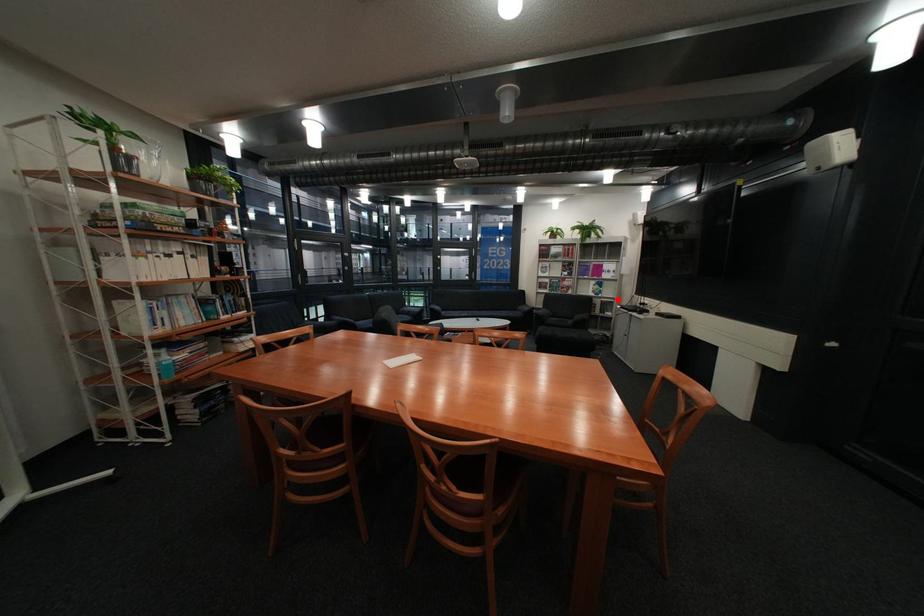
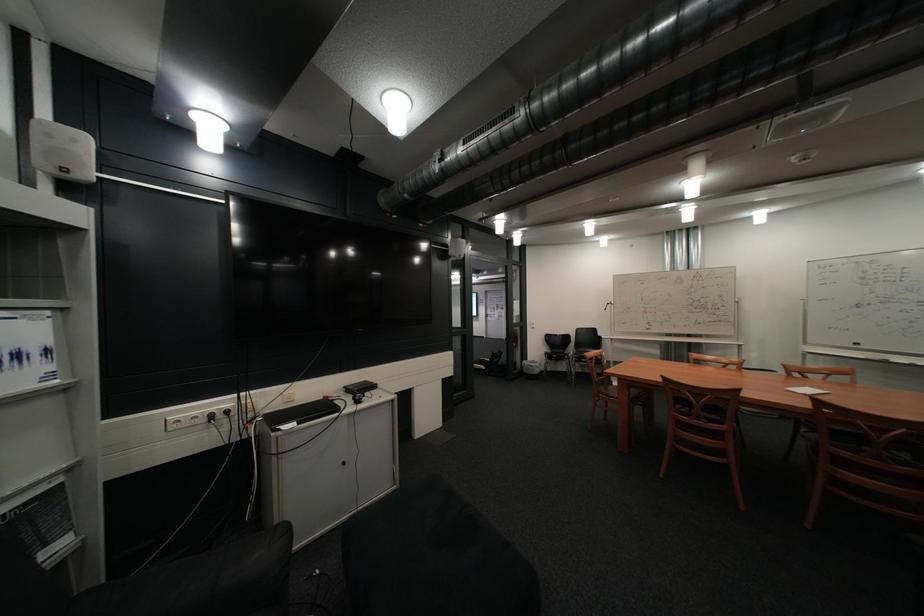
Question: I am providing you with two images of the same scene from different viewpoints. Image1 has a red point marked. In image2, the corresponding 3D location appears at what relative position? Reply with the corresponding letter.

Choices:
 (A) Closer
 (B) Farther

Answer: (B)